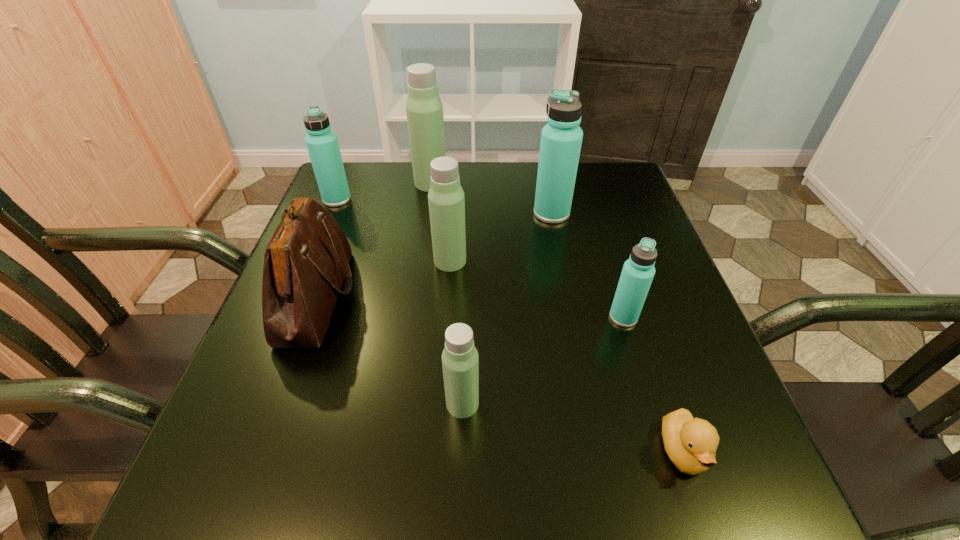
The height and width of the screenshot is (540, 960). I want to click on free space between the second aqua thermos bottle from left to right and the second nearest object, so click(x=507, y=308).

Identify the location of vacant space in between the second smallest aqua thermos bottle and the smallest light thermos bottle. The width and height of the screenshot is (960, 540). (399, 301).

Locate an element on the screen. Image resolution: width=960 pixels, height=540 pixels. vacant space that's between the nearest aqua thermos bottle and the nearest object is located at coordinates (653, 384).

Select which object is the second closest to the biggest light thermos bottle. Please provide its 2D coordinates. Your answer should be formatted as a tuple, i.e. [(x, y)], where the tuple contains the x and y coordinates of a point satisfying the conditions above.

[(561, 138)]

Identify which object is the fifth nearest to the second nearest light thermos bottle. Please provide its 2D coordinates. Your answer should be formatted as a tuple, i.e. [(x, y)], where the tuple contains the x and y coordinates of a point satisfying the conditions above.

[(322, 144)]

Choose which thermos bottle is the third nearest neighbor to the second farthest light thermos bottle. Please provide its 2D coordinates. Your answer should be formatted as a tuple, i.e. [(x, y)], where the tuple contains the x and y coordinates of a point satisfying the conditions above.

[(460, 361)]

Locate an element on the screen. thermos bottle that is the second nearest to the nearest object is located at coordinates (460, 361).

Identify which light thermos bottle is the second closest to the farthest light thermos bottle. Please provide its 2D coordinates. Your answer should be formatted as a tuple, i.e. [(x, y)], where the tuple contains the x and y coordinates of a point satisfying the conditions above.

[(460, 361)]

Identify which light thermos bottle is located as the nearest to the brown shoulder bag. Please provide its 2D coordinates. Your answer should be formatted as a tuple, i.e. [(x, y)], where the tuple contains the x and y coordinates of a point satisfying the conditions above.

[(446, 200)]

This screenshot has height=540, width=960. In order to click on aqua thermos bottle that is the closest to the second nearest object in this screenshot , I will do `click(638, 271)`.